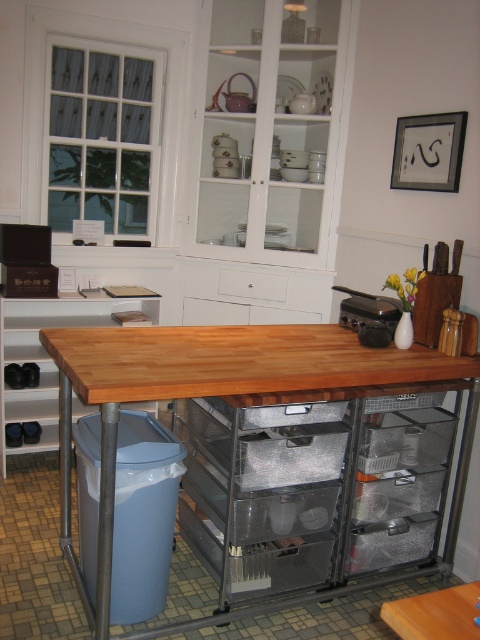
You are standing in the kitchen and want to reach the point at coordinates (296, 125). If your arm can extend 1.5 meters, can you reach that point without moving?

The point at coordinates (296, 125) is 3.57 meters away from the camera, which is further than your arm can reach. You will need to move closer to reach it.

You are a delivery person who just arrived at the kitchen. You need to place a large box that is 5 feet long on the floor between the white glossy cabinet at upper center and the wooden table at center. Is there enough space for the box?

The white glossy cabinet at upper center is 4.71 feet away from the wooden table at center. Since the distance between them is less than the length of the box, the box cannot be placed there as it requires more space than available.

You are organizing a dinner party and need to place a tall centerpiece on the tallest surface available. Which object should you choose between the white glossy cabinet at upper center and the wooden table at center?

The white glossy cabinet at upper center has a greater height compared to the wooden table at center, so you should place the tall centerpiece on the white glossy cabinet at upper center.